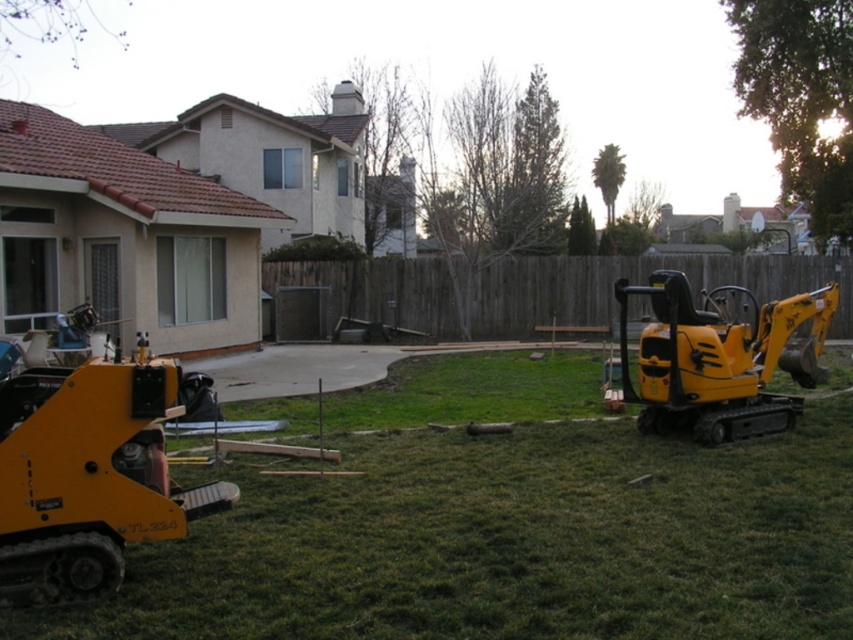
You are planning to set up a small garden in the residential backyard shown. The garden requires a space that is wider than the yellow rubber excavator at right. Can the green grass at lower center provide enough space for this garden?

The green grass at lower center is thinner than the yellow rubber excavator at right, so it is narrower. Therefore, the green grass at lower center cannot provide enough space for the garden that requires a wider area than the yellow rubber excavator at right.

You are planning to install a new fence post between the yellow rubber tracked excavator at lower left and the wooden fence at center. The post requires a minimum of 60 feet of space between the excavator and the fence to be safely installed. Based on the scene description, is the current distance sufficient?

The yellow rubber tracked excavator at lower left and wooden fence at center are 58.37 feet apart, which is less than the required 60 feet. Therefore, the current distance is insufficient for safely installing the fence post.